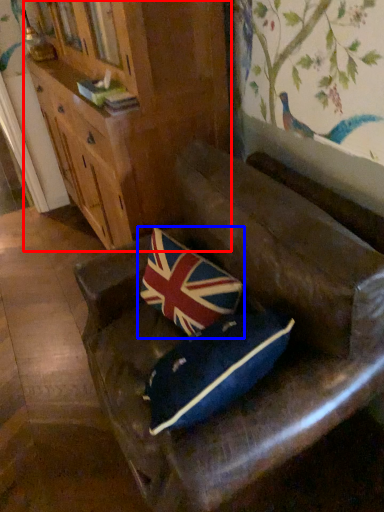
Question: Among these objects, which one is nearest to the camera, cabinetry (highlighted by a red box) or pillow (highlighted by a blue box)?

Choices:
 (A) cabinetry
 (B) pillow

Answer: (B)